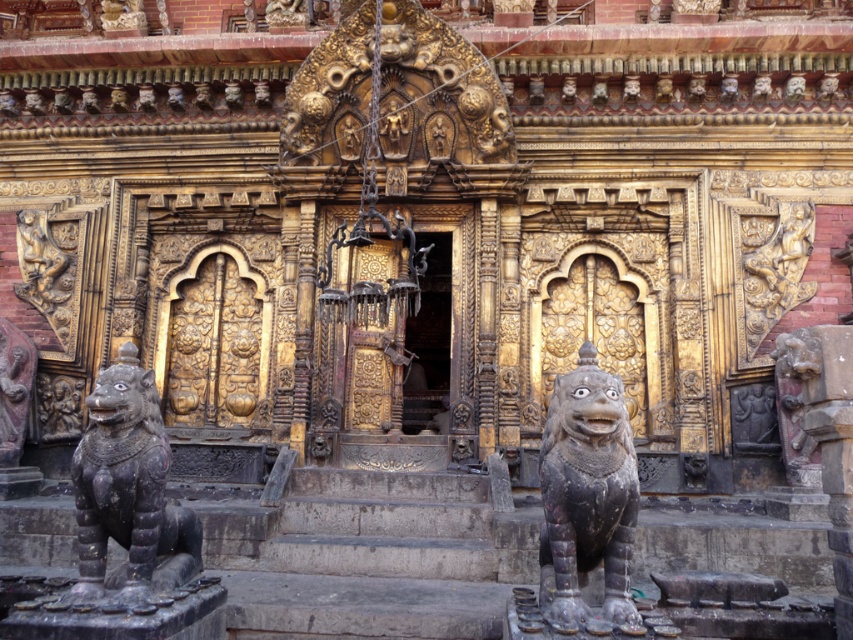
Question: Does dark gray stone lion at center come in front of black stone lion at lower left?

Choices:
 (A) yes
 (B) no

Answer: (A)

Question: Which point is closer to the camera?

Choices:
 (A) (567, 406)
 (B) (196, 573)

Answer: (A)

Question: Does dark gray stone lion at center appear under black stone lion at lower left?

Choices:
 (A) no
 (B) yes

Answer: (A)

Question: Which object is farther from the camera taking this photo?

Choices:
 (A) dark gray stone lion at center
 (B) black stone lion at lower left

Answer: (B)

Question: Does dark gray stone lion at center appear on the left side of black stone lion at lower left?

Choices:
 (A) no
 (B) yes

Answer: (A)

Question: Which of the following is the farthest from the observer?

Choices:
 (A) black stone lion at lower left
 (B) dark gray stone lion at center

Answer: (A)